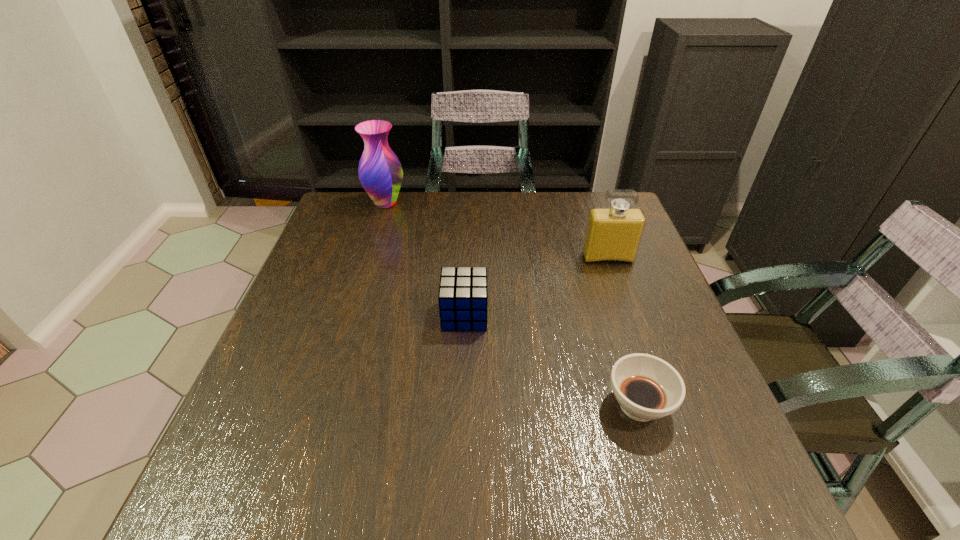
Find the location of `vacant region at the right edge of the desktop`. vacant region at the right edge of the desktop is located at coordinates (681, 415).

The height and width of the screenshot is (540, 960). In order to click on vacant space at the near left corner in this screenshot , I will do `click(251, 513)`.

Find the location of a particular element. The height and width of the screenshot is (540, 960). free point between the perfume and the shortest object is located at coordinates (623, 332).

This screenshot has height=540, width=960. I want to click on vacant point located between the leftmost object and the nearest object, so click(512, 304).

This screenshot has height=540, width=960. I want to click on free space that is in between the nearest object and the vase, so click(x=512, y=304).

Identify the location of empty location between the vase and the shortest object. (512, 304).

At what (x,y) coordinates should I click in order to perform the action: click on vacant space in between the nearest object and the third tallest object. Please return your answer as a coordinate pair (x, y). The height and width of the screenshot is (540, 960). Looking at the image, I should click on (551, 360).

The height and width of the screenshot is (540, 960). Identify the location of vacant region between the farthest object and the nearest object. (512, 304).

This screenshot has height=540, width=960. Identify the location of free spot between the third object from right to left and the perfume. (536, 287).

Where is `free area in between the shortest object and the second shortest object`? free area in between the shortest object and the second shortest object is located at coordinates (551, 360).